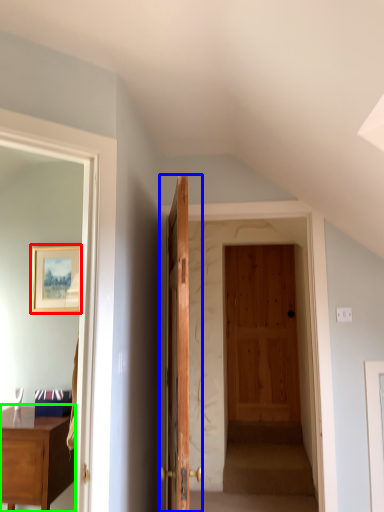
Question: Which is farther away from picture frame (highlighted by a red box)? door (highlighted by a blue box) or desk (highlighted by a green box)?

Choices:
 (A) door
 (B) desk

Answer: (B)